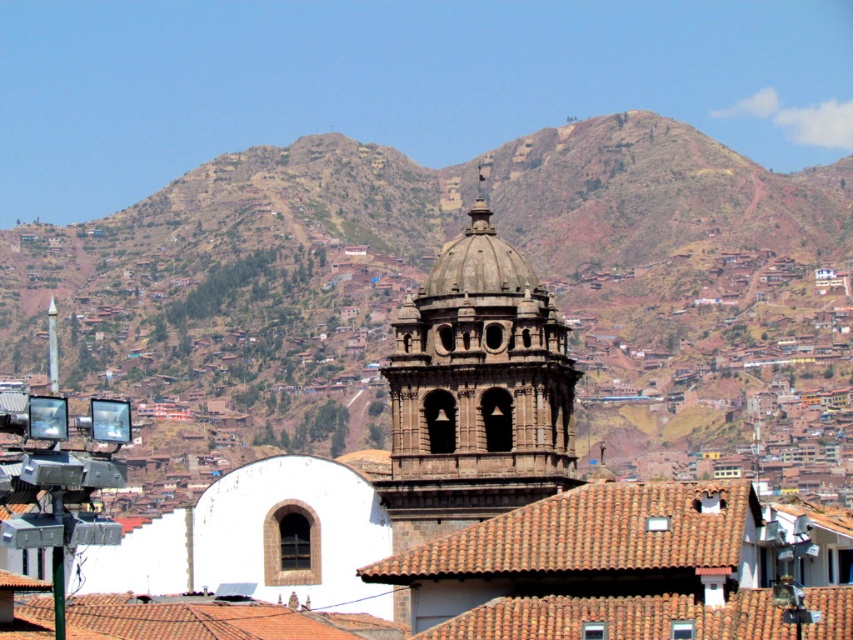
You are standing in the city area shown in the image and want to take a photo of the brown rocky mountain at upper center. If your camera has a maximum zoom range of 50 meters, will you be able to capture the entire mountain in one shot without moving closer?

The distance between you and the brown rocky mountain at upper center is 82.77 meters, which exceeds the camera maximum zoom range of 50 meters. Therefore, you won not be able to capture the entire mountain in one shot without moving closer.

You are a tourist standing at the base of the city looking towards the mountains. You see the brown rocky mountain at upper center and the dark brown stone tower at center. Which structure is closer to you?

The dark brown stone tower at center is closer to you because the brown rocky mountain at upper center is positioned under it, indicating it is further away.